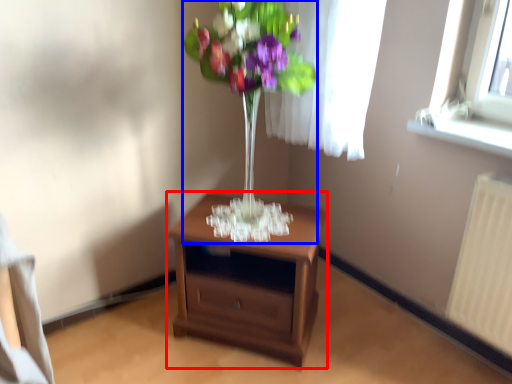
Question: Which object is further to the camera taking this photo, nightstand (highlighted by a red box) or floral arrangement (highlighted by a blue box)?

Choices:
 (A) nightstand
 (B) floral arrangement

Answer: (A)